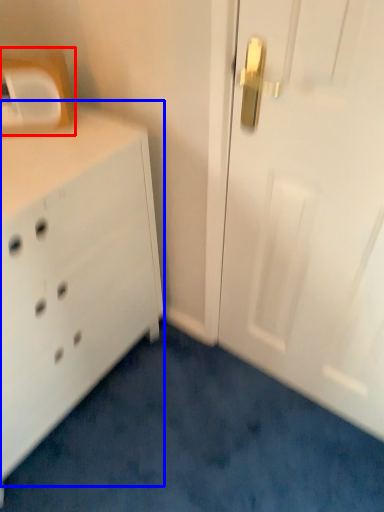
Question: Which of the following is the closest to the observer, medicine cabinet (highlighted by a red box) or chest of drawers (highlighted by a blue box)?

Choices:
 (A) medicine cabinet
 (B) chest of drawers

Answer: (B)